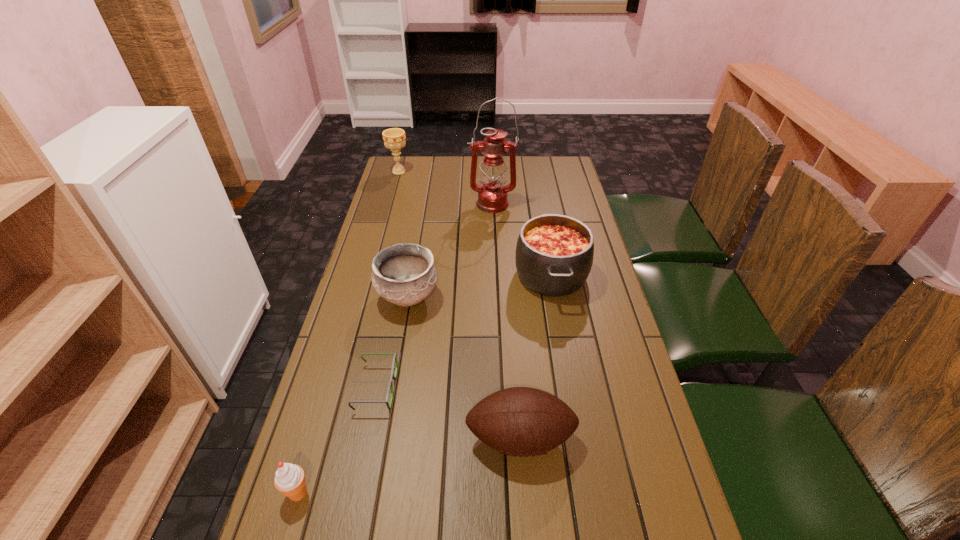
Locate an element on the screen. vacant space that's between the pottery and the nearest object is located at coordinates (353, 395).

The width and height of the screenshot is (960, 540). Identify the location of free space between the pottery and the oil lamp. (449, 251).

At what (x,y) coordinates should I click in order to perform the action: click on vacant space in between the sixth nearest object and the nearest object. Please return your answer as a coordinate pair (x, y). This screenshot has width=960, height=540. Looking at the image, I should click on (395, 348).

You are a GUI agent. You are given a task and a screenshot of the screen. Output one action in this format:
    pyautogui.click(x=<x>, y=<y>)
    Task: Click on the vacant area that lies between the casserole and the shortest object
    
    Given the screenshot: What is the action you would take?
    pyautogui.click(x=464, y=332)

Identify which object is the closest to the football. Please provide its 2D coordinates. Your answer should be formatted as a tuple, i.e. [(x, y)], where the tuple contains the x and y coordinates of a point satisfying the conditions above.

[(393, 376)]

This screenshot has height=540, width=960. In order to click on object that is the closest to the casserole in this screenshot , I will do `click(492, 197)`.